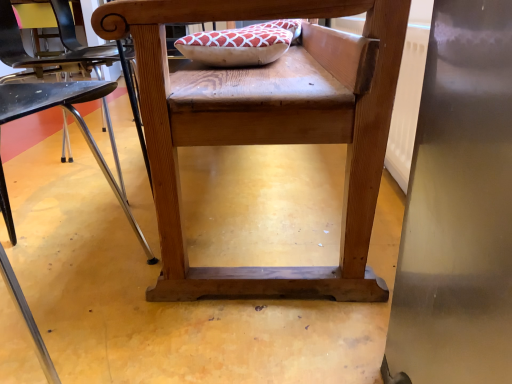
Question: Relative to wooden chair at center, the 2th chair in the right-to-left sequence, is wooden chair at center, arranged as the 2th chair when viewed from the left, in front or behind?

Choices:
 (A) front
 (B) behind

Answer: (B)

Question: Would you say wooden chair at center, arranged as the 2th chair when viewed from the left, is inside or outside wooden chair at center, the 2th chair in the right-to-left sequence?

Choices:
 (A) outside
 (B) inside

Answer: (A)

Question: Considering the positions of wooden chair at center, arranged as the 2th chair when viewed from the left, and wooden chair at center, the 2th chair in the right-to-left sequence, in the image, is wooden chair at center, arranged as the 2th chair when viewed from the left, bigger or smaller than wooden chair at center, the 2th chair in the right-to-left sequence,?

Choices:
 (A) big
 (B) small

Answer: (A)

Question: Is point (x=0, y=34) positioned closer to the camera than point (x=352, y=266)?

Choices:
 (A) closer
 (B) farther

Answer: (B)

Question: Considering the relative positions of wooden chair at center, the 2th chair in the right-to-left sequence, and wooden chair at center, arranged as the 2th chair when viewed from the left, in the image provided, is wooden chair at center, the 2th chair in the right-to-left sequence, to the left or to the right of wooden chair at center, arranged as the 2th chair when viewed from the left,?

Choices:
 (A) left
 (B) right

Answer: (A)

Question: In terms of height, does wooden chair at center, which ranks as the first chair in left-to-right order, look taller or shorter compared to wooden chair at center, the 1th chair viewed from the right?

Choices:
 (A) short
 (B) tall

Answer: (A)

Question: Is wooden chair at center, which ranks as the first chair in left-to-right order, in front of or behind wooden chair at center, arranged as the 2th chair when viewed from the left, in the image?

Choices:
 (A) behind
 (B) front

Answer: (B)